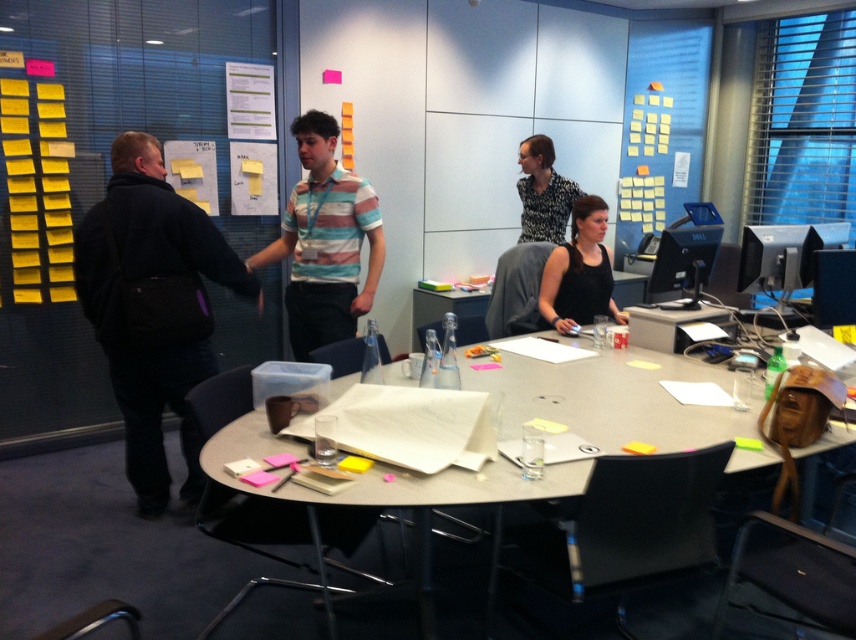
Question: Can you confirm if matte gray table at center is positioned above black matte tank top at center?

Choices:
 (A) no
 (B) yes

Answer: (A)

Question: Which of the following is the closest to the observer?

Choices:
 (A) (76, 230)
 (B) (254, 252)
 (C) (524, 224)

Answer: (A)

Question: Can you confirm if striped cotton shirt at center is positioned to the right of printed fabric blouse at center?

Choices:
 (A) yes
 (B) no

Answer: (B)

Question: Does striped cotton shirt at center appear on the right side of printed fabric blouse at center?

Choices:
 (A) no
 (B) yes

Answer: (A)

Question: Considering the real-world distances, which object is closest to the matte gray table at center?

Choices:
 (A) dark gray jacket at left
 (B) printed fabric blouse at center
 (C) striped cotton shirt at center

Answer: (C)

Question: Which object is positioned closest to the striped cotton shirt at center?

Choices:
 (A) black matte tank top at center
 (B) matte gray table at center
 (C) printed fabric blouse at center
 (D) dark gray jacket at left

Answer: (D)